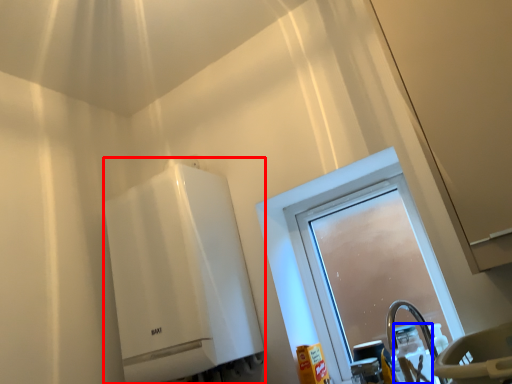
Question: Which object appears closest to the camera in this image, water heater (highlighted by a red box) or bottle (highlighted by a blue box)?

Choices:
 (A) water heater
 (B) bottle

Answer: (B)